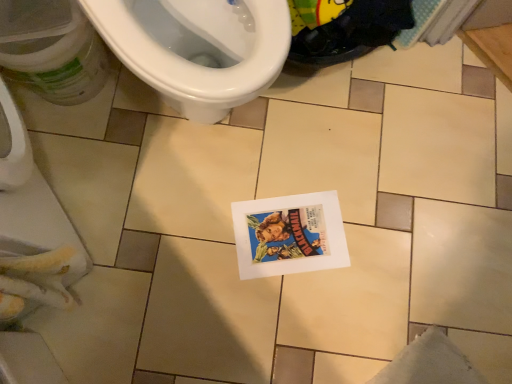
Identify the location of white glossy toilet at upper left. (197, 48).

From the image's perspective, is white glossy toilet at upper left located above or below white paper comic book at center?

Based on their image positions, white glossy toilet at upper left is located above white paper comic book at center.

Which of these two, white glossy toilet at upper left or white paper comic book at center, is thinner?

Thinner between the two is white paper comic book at center.

What's the angular difference between white glossy toilet at upper left and white paper comic book at center's facing directions?

150 degrees.

Is white glossy toilet at upper left far from white paper comic book at center?

white glossy toilet at upper left is near white paper comic book at center, not far away.

Considering the relative sizes of white glossy toilet at upper left and white glossy toilet at upper left in the image provided, is white glossy toilet at upper left wider than white glossy toilet at upper left?

Indeed, white glossy toilet at upper left has a greater width compared to white glossy toilet at upper left.

Is white glossy toilet at upper left shorter than white glossy toilet at upper left?

No, white glossy toilet at upper left is not shorter than white glossy toilet at upper left.

From a real-world perspective, which object stands above the other?

white glossy toilet at upper left.

What's the angular difference between white glossy toilet at upper left and white glossy toilet at upper left's facing directions?

white glossy toilet at upper left and white glossy toilet at upper left are facing 0.000346 degrees away from each other.

Considering the relative positions of white glossy toilet at upper left and white glossy toilet at upper left in the image provided, is white glossy toilet at upper left to the right of white glossy toilet at upper left from the viewer's perspective?

No, white glossy toilet at upper left is not to the right of white glossy toilet at upper left.

From a real-world perspective, which object rests below the other?

white glossy toilet at upper left.

Which object is further away from the camera, white glossy toilet at upper left or white glossy toilet at upper left?

white glossy toilet at upper left is behind.

From the image's perspective, relative to white glossy toilet at upper left, is white paper comic book at center above or below?

white paper comic book at center is below white glossy toilet at upper left.

Based on the photo, from a real-world perspective, is white paper comic book at center over white glossy toilet at upper left?

No.

What's the angular difference between white paper comic book at center and white glossy toilet at upper left's facing directions?

white paper comic book at center and white glossy toilet at upper left are facing 150 degrees away from each other.

Does white paper comic book at center turn towards white glossy toilet at upper left?

Yes, white paper comic book at center is facing white glossy toilet at upper left.

Are white paper comic book at center and white glossy toilet at upper left located far from each other?

They are positioned close to each other.

Which object is closer to the camera, white paper comic book at center or white glossy toilet at upper left?

white glossy toilet at upper left is closer to the camera.

Is white paper comic book at center thinner than white glossy toilet at upper left?

Yes, white paper comic book at center is thinner than white glossy toilet at upper left.

Is white glossy toilet at upper left completely or partially inside white paper comic book at center?

No.

Is white glossy toilet at upper left positioned beyond the bounds of white paper comic book at center?

Absolutely, white glossy toilet at upper left is external to white paper comic book at center.

The width and height of the screenshot is (512, 384). What are the coordinates of `toilet located above the white paper comic book at center (from a real-world perspective)` in the screenshot? It's located at (197, 48).

From the image's perspective, relative to white paper comic book at center, is white glossy toilet at upper left above or below?

white glossy toilet at upper left is above white paper comic book at center.

From a real-world perspective, does white glossy toilet at upper left sit lower than white paper comic book at center?

Incorrect, from a real-world perspective, white glossy toilet at upper left is higher than white paper comic book at center.

In the image, there is a white paper comic book at center. Where is `potty below it (from a real-world perspective)`? potty below it (from a real-world perspective) is located at coordinates (52, 49).

Locate an element on the screen. The height and width of the screenshot is (384, 512). potty on the left of white glossy toilet at upper left is located at coordinates (52, 49).

Estimate the real-world distances between objects in this image. Which object is closer to white paper comic book at center, white glossy toilet at upper left or white glossy toilet at upper left?

white glossy toilet at upper left.

From the image, which object appears to be farther from white glossy toilet at upper left, white paper comic book at center or white glossy toilet at upper left?

white paper comic book at center is further to white glossy toilet at upper left.

Based on their spatial positions, is white paper comic book at center or white glossy toilet at upper left further from white glossy toilet at upper left?

white paper comic book at center is positioned further to the anchor white glossy toilet at upper left.

From the image, which object appears to be farther from white glossy toilet at upper left, white glossy toilet at upper left or white paper comic book at center?

white paper comic book at center.

Based on their spatial positions, is white glossy toilet at upper left or white glossy toilet at upper left closer to white paper comic book at center?

white glossy toilet at upper left lies closer to white paper comic book at center than the other object.

Considering their positions, is white glossy toilet at upper left positioned further to white glossy toilet at upper left than white paper comic book at center?

white paper comic book at center is further to white glossy toilet at upper left.

The width and height of the screenshot is (512, 384). Find the location of `toilet between white glossy toilet at upper left and white paper comic book at center in the horizontal direction`. toilet between white glossy toilet at upper left and white paper comic book at center in the horizontal direction is located at coordinates (197, 48).